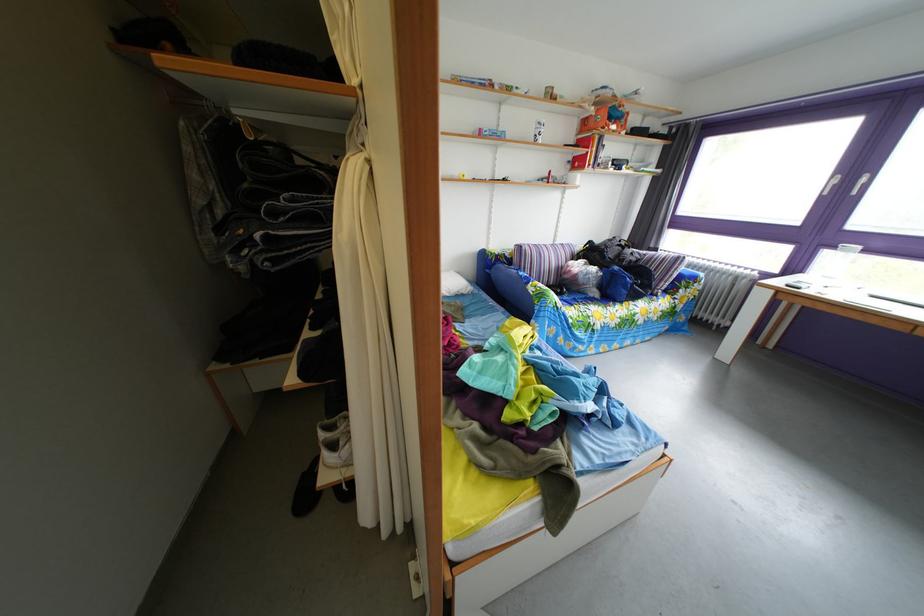
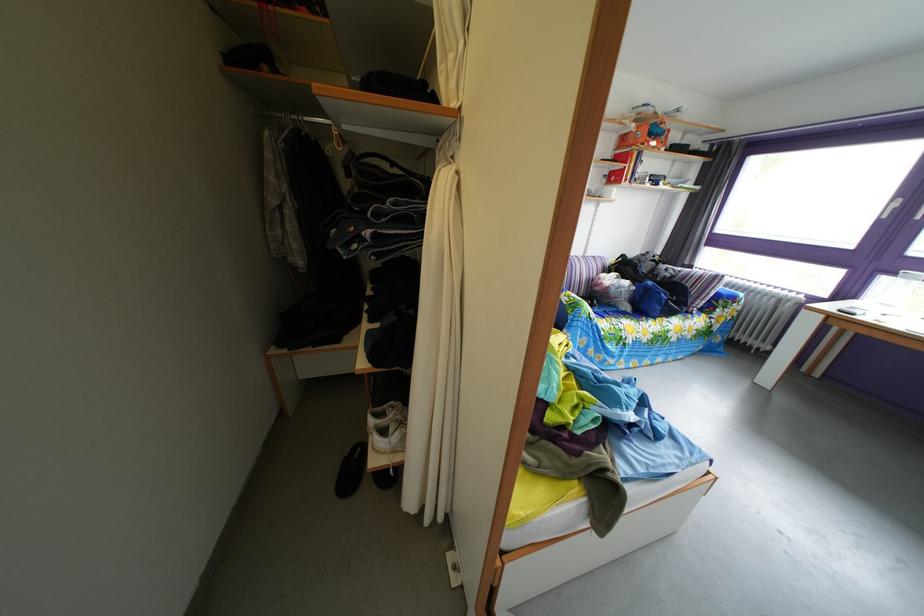
Locate, in the second image, the point that corresponds to point 565,249 in the first image.

(596, 261)